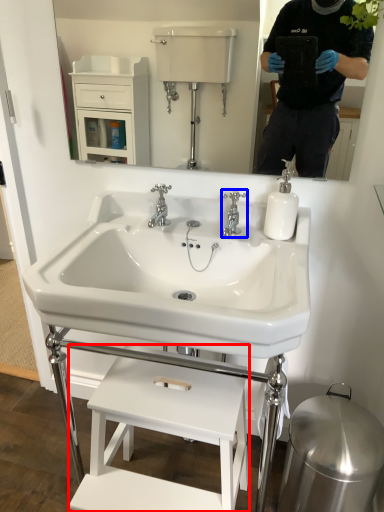
Question: Which point is further to the camera, furniture (highlighted by a red box) or tap (highlighted by a blue box)?

Choices:
 (A) furniture
 (B) tap

Answer: (B)